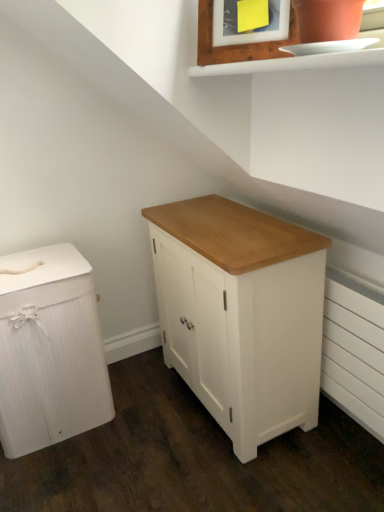
Find the location of a particular element. This screenshot has width=384, height=512. free point above white painted wood cabinet at center, the first chest of drawers viewed from the right (from a real-world perspective) is located at coordinates (221, 224).